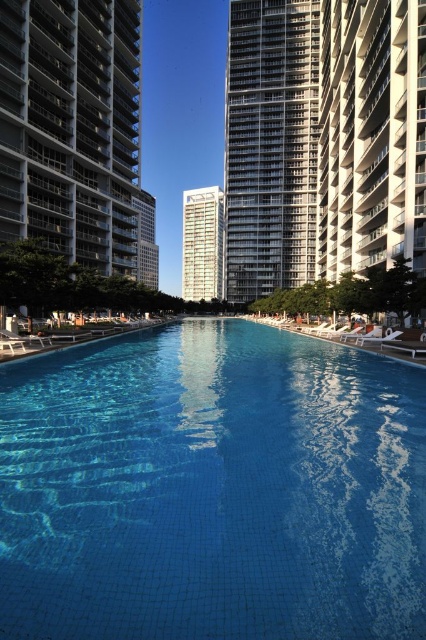
Can you confirm if white glass condominium at left is smaller than silver metallic building at center?

No, white glass condominium at left is not smaller than silver metallic building at center.

Is point (115, 268) positioned after point (229, 93)?

No, it is not.

What do you see at coordinates (74, 132) in the screenshot? This screenshot has width=426, height=640. I see `white glass condominium at left` at bounding box center [74, 132].

You are a GUI agent. You are given a task and a screenshot of the screen. Output one action in this format:
    pyautogui.click(x=<x>, y=<y>)
    Task: Click on the white glass condominium at left
    Image resolution: width=426 pixels, height=640 pixels.
    Given the screenshot: What is the action you would take?
    pyautogui.click(x=74, y=132)

Who is more forward, (106, 250) or (189, 248)?

Point (106, 250) is more forward.

Is white glass condominium at left to the right of white glass tower at center from the viewer's perspective?

Incorrect, white glass condominium at left is not on the right side of white glass tower at center.

Who is more forward, (43, 61) or (213, 298)?

Point (43, 61) is more forward.

The image size is (426, 640). Identify the location of white glass condominium at left. (74, 132).

The width and height of the screenshot is (426, 640). What do you see at coordinates (213, 490) in the screenshot?
I see `blue tile swimming pool at center` at bounding box center [213, 490].

Is blue tile swimming pool at center smaller than white glass tower at center?

Correct, blue tile swimming pool at center occupies less space than white glass tower at center.

At what (x,y) coordinates should I click in order to perform the action: click on blue tile swimming pool at center. Please return your answer as a coordinate pair (x, y). This screenshot has width=426, height=640. Looking at the image, I should click on (213, 490).